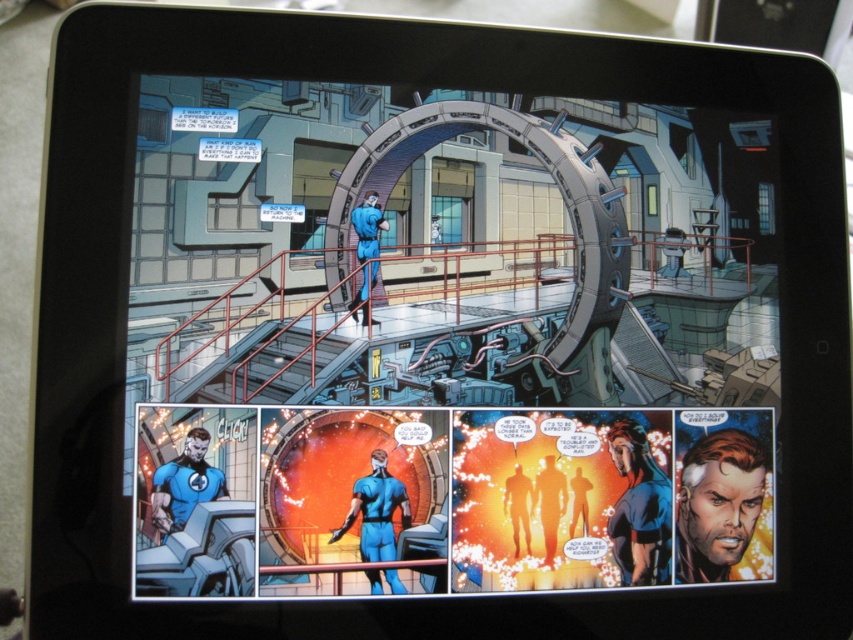
Does blue glossy figure at center have a lesser width compared to blue glossy suit at center?

No, blue glossy figure at center is not thinner than blue glossy suit at center.

Between blue glossy figure at center and blue glossy suit at center, which one appears on the left side from the viewer's perspective?

From the viewer's perspective, blue glossy suit at center appears more on the left side.

Who is more forward, (535, 424) or (363, 528)?

Point (363, 528)

Locate an element on the screen. blue glossy figure at center is located at coordinates [560, 499].

How far apart are blue glossy figure at center and matte blue suit at bottom left?

blue glossy figure at center is 7.04 inches from matte blue suit at bottom left.

Is blue glossy figure at center behind matte blue suit at bottom left?

That is True.

Does point (601, 531) come closer to viewer compared to point (161, 486)?

No.

Image resolution: width=853 pixels, height=640 pixels. In order to click on blue glossy figure at center in this screenshot , I will do `click(560, 499)`.

Between blue glossy suit at center and matte blue suit at bottom left, which one appears on the right side from the viewer's perspective?

Positioned to the right is blue glossy suit at center.

From the picture: Who is taller, blue glossy suit at center or matte blue suit at bottom left?

blue glossy suit at center is taller.

Is point (364, 554) positioned behind point (170, 508)?

Yes.

This screenshot has height=640, width=853. Find the location of `blue glossy suit at center`. blue glossy suit at center is located at coordinates (376, 509).